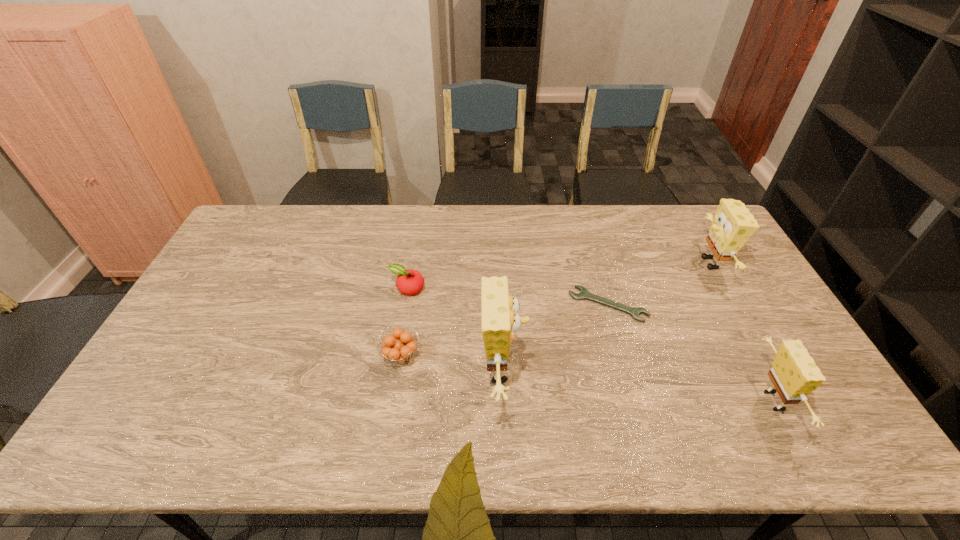
Locate an element on the screen. The height and width of the screenshot is (540, 960). vacant region located 0.050m on the face of the third tallest object is located at coordinates (811, 401).

This screenshot has height=540, width=960. I want to click on free spot located 0.100m on the face of the farthest sponge, so click(665, 263).

Find the location of `free space located 0.120m on the face of the farthest sponge`. free space located 0.120m on the face of the farthest sponge is located at coordinates (660, 263).

I want to click on vacant space located 0.250m on the face of the farthest sponge, so click(621, 263).

Locate an element on the screen. vacant space located 0.190m on the left of the apple is located at coordinates (329, 289).

Find the location of a particular element. The image size is (960, 540). free space located on the left of the shortest object is located at coordinates (455, 304).

You are a GUI agent. You are given a task and a screenshot of the screen. Output one action in this format:
    pyautogui.click(x=<x>, y=<y>)
    Task: Click on the free space located 0.310m on the back of the orange fruit
    
    Given the screenshot: What is the action you would take?
    pyautogui.click(x=415, y=265)

You are a GUI agent. You are given a task and a screenshot of the screen. Output one action in this format:
    pyautogui.click(x=<x>, y=<y>)
    Task: Click on the object positioned at the far edge
    The height and width of the screenshot is (540, 960).
    Given the screenshot: What is the action you would take?
    pyautogui.click(x=733, y=224)

Find the location of a particular element. The width and height of the screenshot is (960, 540). object at the far right corner is located at coordinates (733, 224).

Find the location of a particular element. The height and width of the screenshot is (540, 960). object that is at the near right corner is located at coordinates [x=794, y=374].